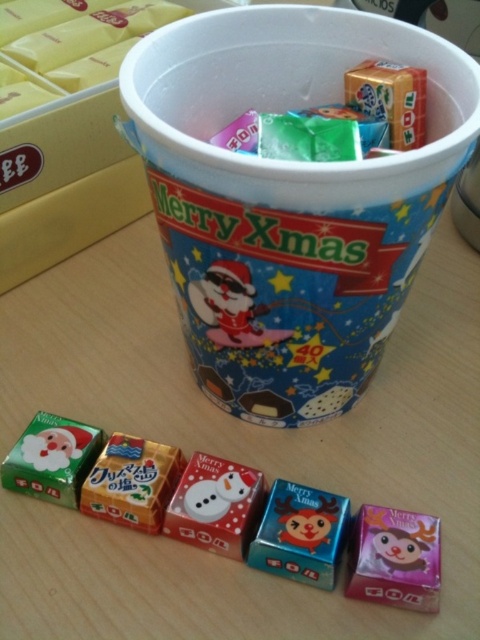
Is santa claus figure at center wider than matte green paper santa at lower left?

Correct, the width of santa claus figure at center exceeds that of matte green paper santa at lower left.

Does santa claus figure at center have a lesser height compared to matte green paper santa at lower left?

Incorrect, santa claus figure at center's height does not fall short of matte green paper santa at lower left's.

Identify the location of santa claus figure at center. (231, 307).

Who is more forward, [46,636] or [49,493]?

Point [46,636]

The width and height of the screenshot is (480, 640). What do you see at coordinates (230, 456) in the screenshot?
I see `wooden table at center` at bounding box center [230, 456].

Between point (397, 444) and point (48, 428), which one is positioned behind?

The point (397, 444) is more distant.

You are a GUI agent. You are given a task and a screenshot of the screen. Output one action in this format:
    pyautogui.click(x=<x>, y=<y>)
    Task: Click on the wooden table at center
    Image resolution: width=480 pixels, height=640 pixels.
    Given the screenshot: What is the action you would take?
    pyautogui.click(x=230, y=456)

Does santa claus figure at center have a greater width compared to metallic blue candy at center?

Correct, the width of santa claus figure at center exceeds that of metallic blue candy at center.

Does santa claus figure at center have a larger size compared to metallic blue candy at center?

Yes.

Find the location of a particular element. The height and width of the screenshot is (640, 480). santa claus figure at center is located at coordinates (231, 307).